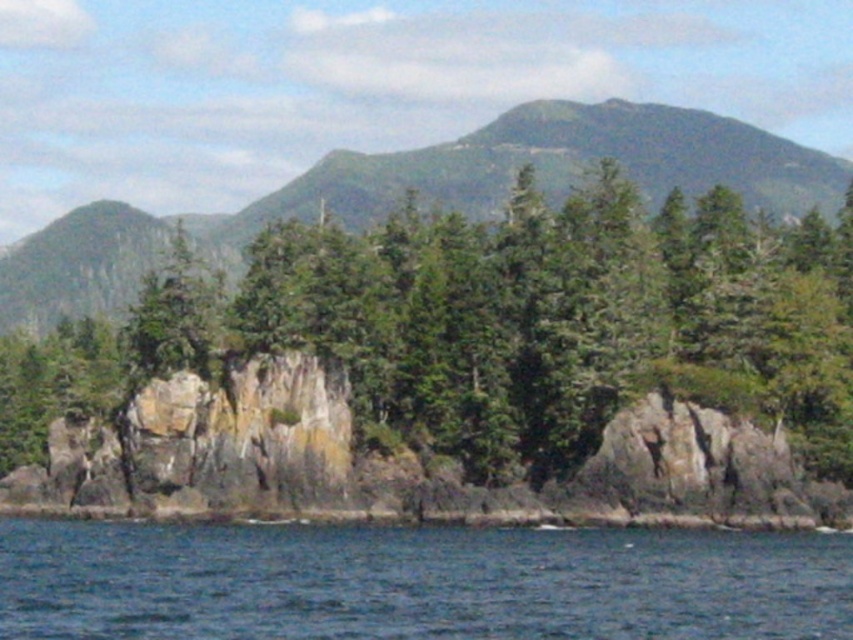
Is blue water at lower left wider than green textured mountain at upper center?

No, blue water at lower left is not wider than green textured mountain at upper center.

Which is more to the right, blue water at lower left or green textured mountain at upper center?

blue water at lower left is more to the right.

Between point (529, 618) and point (643, 145), which one is positioned behind?

The point (643, 145) is more distant.

Locate an element on the screen. The height and width of the screenshot is (640, 853). blue water at lower left is located at coordinates (416, 582).

Is green rough rock at center smaller than green textured mountain at upper center?

Indeed, green rough rock at center has a smaller size compared to green textured mountain at upper center.

Measure the distance between point (161, 321) and camera.

Point (161, 321) and camera are 113.85 meters apart from each other.

Find the location of a particular element. The image size is (853, 640). green rough rock at center is located at coordinates (492, 326).

Find the location of `green rough rock at center`. green rough rock at center is located at coordinates (492, 326).

Is green rough rock at center below blue water at lower left?

No, green rough rock at center is not below blue water at lower left.

Between point (374, 289) and point (78, 624), which one is positioned behind?

Positioned behind is point (374, 289).

Between point (119, 348) and point (12, 568), which one is positioned behind?

The point (119, 348) is behind.

You are a GUI agent. You are given a task and a screenshot of the screen. Output one action in this format:
    pyautogui.click(x=<x>, y=<y>)
    Task: Click on the green rough rock at center
    The image size is (853, 640).
    Given the screenshot: What is the action you would take?
    pyautogui.click(x=492, y=326)